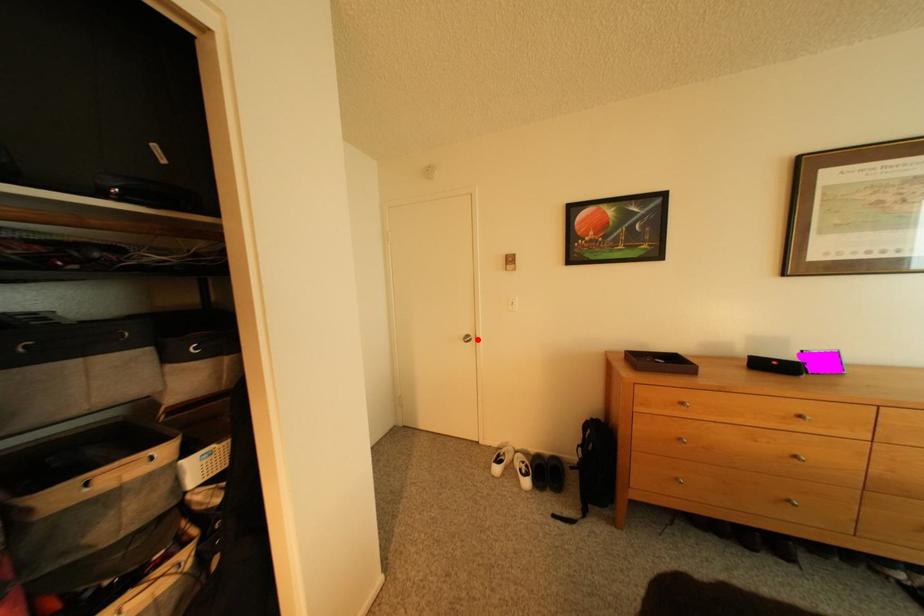
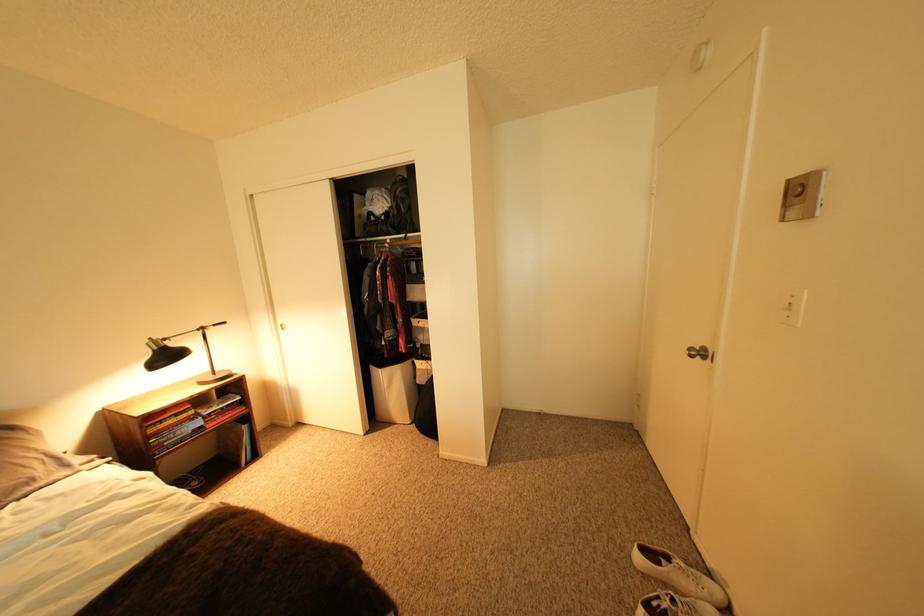
In the second image, find the point that corresponds to the highlighted location in the first image.

(703, 351)